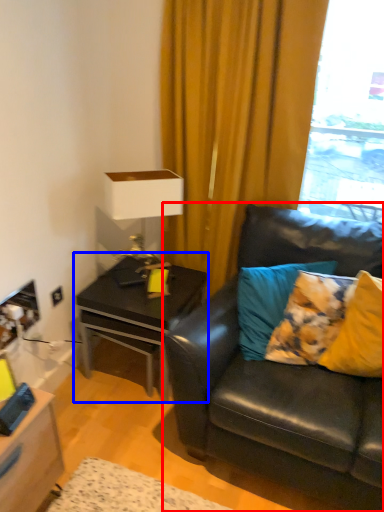
Question: Which object is further to the camera taking this photo, studio couch (highlighted by a red box) or table (highlighted by a blue box)?

Choices:
 (A) studio couch
 (B) table

Answer: (B)